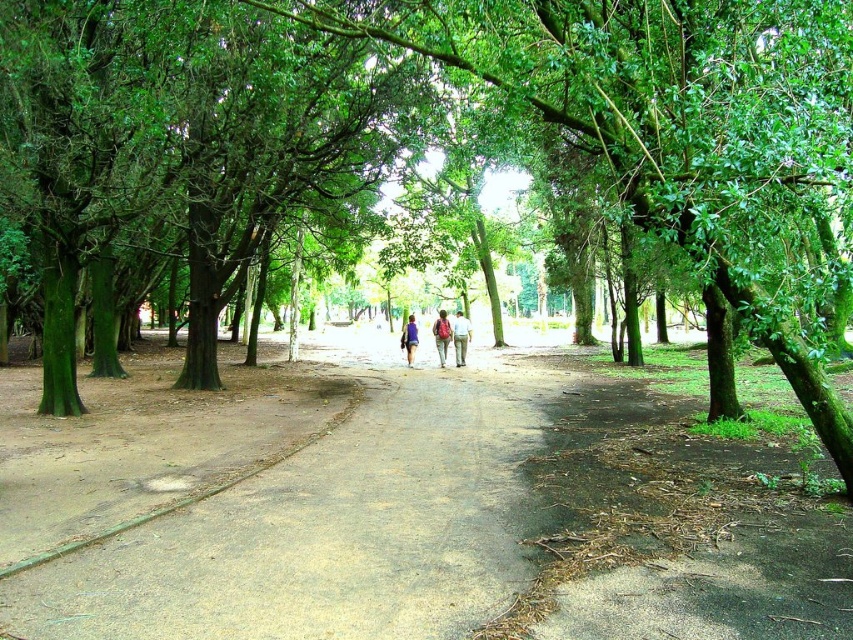
Does light blue denim jeans at center have a smaller size compared to matte pink backpack at center?

Correct, light blue denim jeans at center occupies less space than matte pink backpack at center.

Does light blue denim jeans at center have a greater height compared to matte pink backpack at center?

Incorrect, light blue denim jeans at center's height is not larger of matte pink backpack at center's.

What do you see at coordinates (460, 337) in the screenshot?
I see `light blue denim jeans at center` at bounding box center [460, 337].

Where is `light blue denim jeans at center`? This screenshot has height=640, width=853. light blue denim jeans at center is located at coordinates (460, 337).

Who is positioned more to the right, matte pink backpack at center or blue fabric backpack at center?

matte pink backpack at center is more to the right.

Which is more to the left, matte pink backpack at center or blue fabric backpack at center?

Positioned to the left is blue fabric backpack at center.

This screenshot has height=640, width=853. Identify the location of matte pink backpack at center. (440, 336).

At what (x,y) coordinates should I click in order to perform the action: click on matte pink backpack at center. Please return your answer as a coordinate pair (x, y). The image size is (853, 640). Looking at the image, I should click on (440, 336).

Does matte green backpacks at center have a greater height compared to blue fabric backpack at center?

Yes.

Does matte green backpacks at center appear on the right side of blue fabric backpack at center?

Indeed, matte green backpacks at center is positioned on the right side of blue fabric backpack at center.

Where is `matte green backpacks at center`? The width and height of the screenshot is (853, 640). matte green backpacks at center is located at coordinates (442, 333).

In order to click on matte green backpacks at center in this screenshot , I will do `click(442, 333)`.